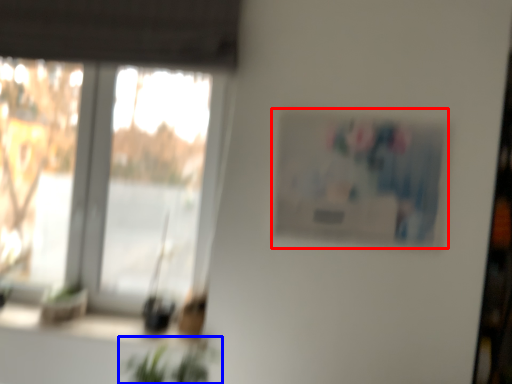
Question: Among these objects, which one is nearest to the camera, picture frame (highlighted by a red box) or houseplant (highlighted by a blue box)?

Choices:
 (A) picture frame
 (B) houseplant

Answer: (B)